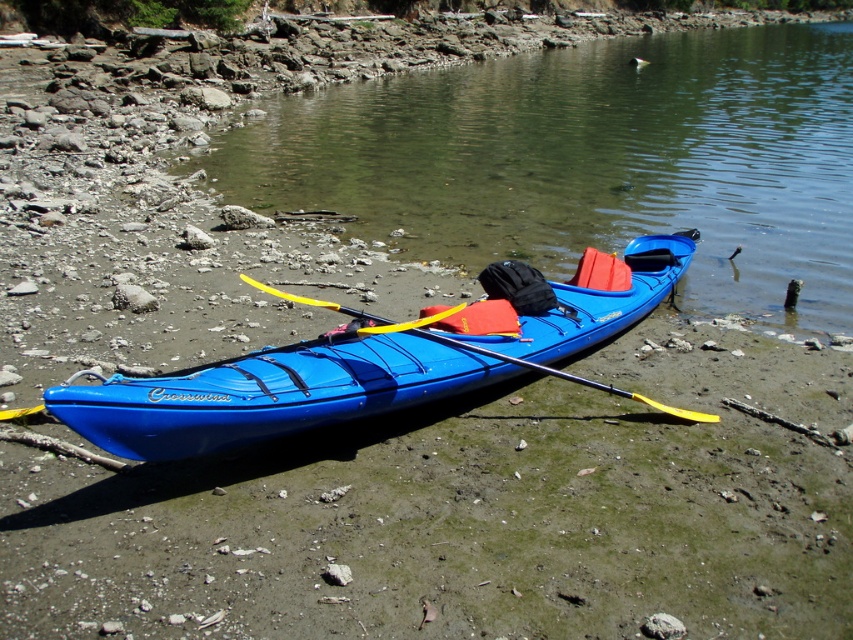
Question: Can you confirm if clear water at lower center is positioned to the left of blue plastic kayak at center?

Choices:
 (A) yes
 (B) no

Answer: (B)

Question: Which of these objects is positioned farthest from the clear water at lower center?

Choices:
 (A) blue plastic kayak at center
 (B) yellow plastic paddle at center

Answer: (B)

Question: Does blue plastic kayak at center have a greater width compared to yellow plastic paddle at center?

Choices:
 (A) no
 (B) yes

Answer: (B)

Question: Which of the following is the closest to the observer?

Choices:
 (A) clear water at lower center
 (B) blue plastic kayak at center

Answer: (B)

Question: Which of the following is the farthest from the observer?

Choices:
 (A) (190, 388)
 (B) (662, 406)
 (C) (625, 124)

Answer: (C)

Question: Does clear water at lower center appear under yellow plastic paddle at center?

Choices:
 (A) yes
 (B) no

Answer: (B)